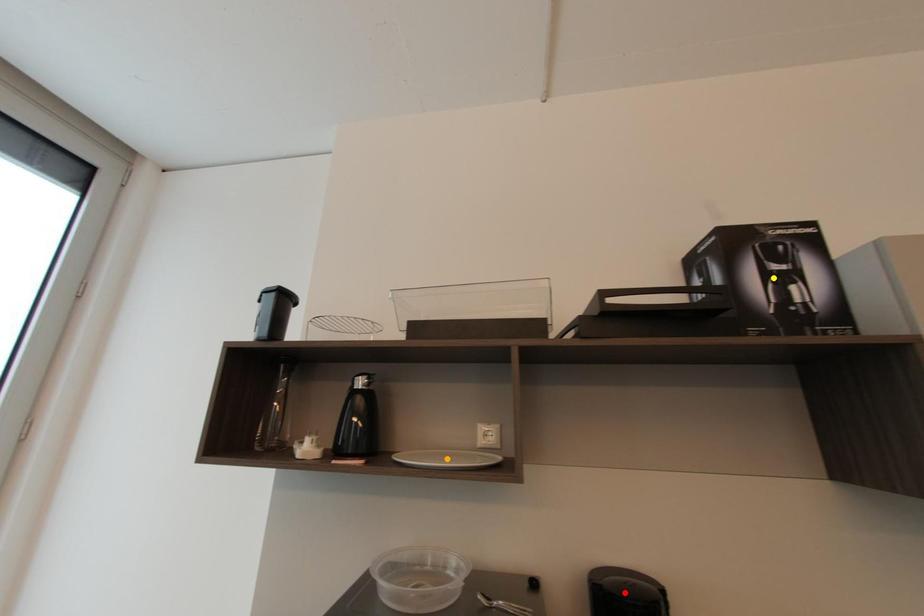
Order these from nearest to farthest:
1. yellow point
2. orange point
3. red point

red point < yellow point < orange point